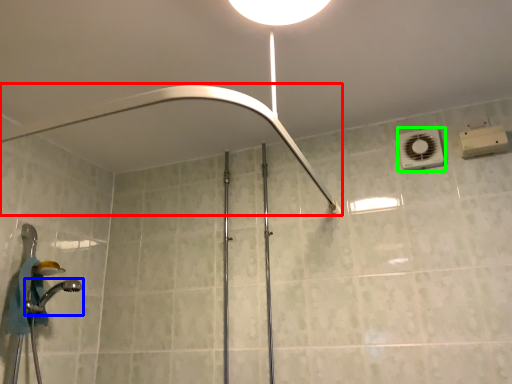
Question: Based on their relative distances, which object is nearer to shower (highlighted by a red box)? Choose from shower (highlighted by a blue box) and air conditioner (highlighted by a green box).

Choices:
 (A) shower
 (B) air conditioner

Answer: (B)